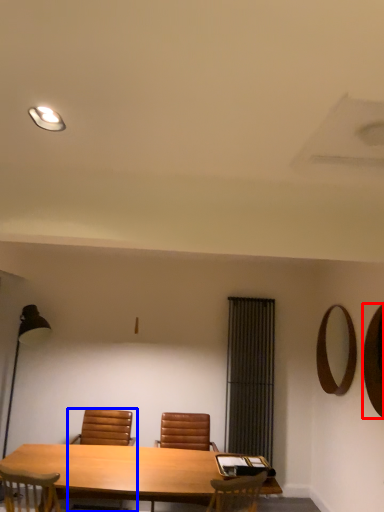
Question: Which point is closer to the camera, mirror (highlighted by a red box) or chair (highlighted by a blue box)?

Choices:
 (A) mirror
 (B) chair

Answer: (A)